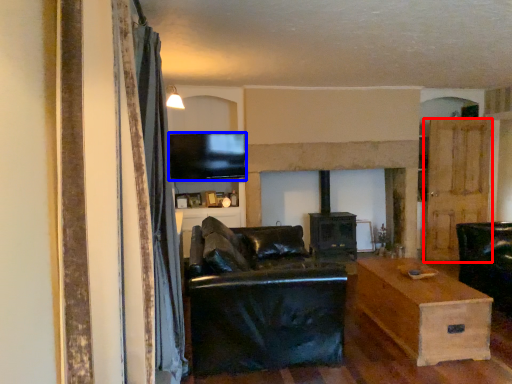
Question: Which point is further to the camera, door (highlighted by a red box) or television (highlighted by a blue box)?

Choices:
 (A) door
 (B) television

Answer: (A)